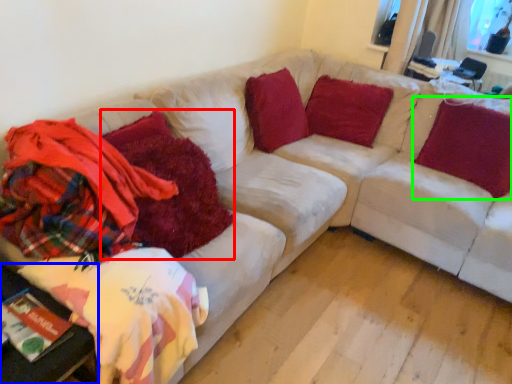
Question: Which is nearer to the blanket (highlighted by a red box)? table (highlighted by a blue box) or pillow (highlighted by a green box).

Choices:
 (A) table
 (B) pillow

Answer: (A)